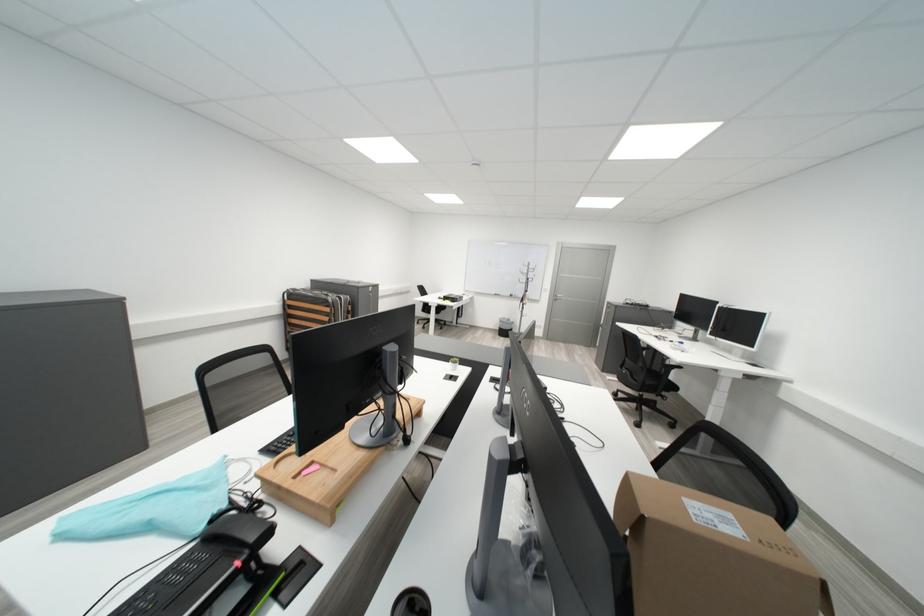
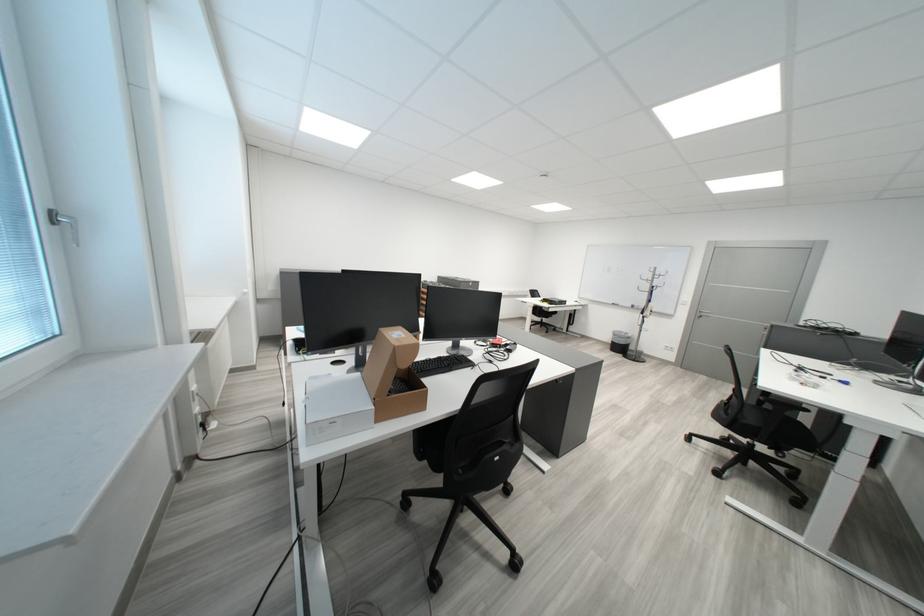
The point at (x=514, y=323) is marked in the first image. Where is the corresponding point in the second image?

(627, 336)